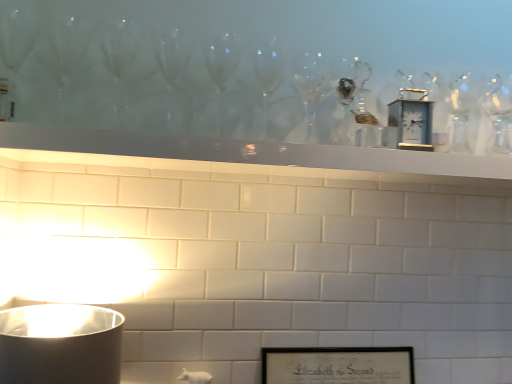
The width and height of the screenshot is (512, 384). What are the coordinates of `empty space that is ontop of black matte picture frame at lower center (from a real-world perspective)` in the screenshot? It's located at (335, 340).